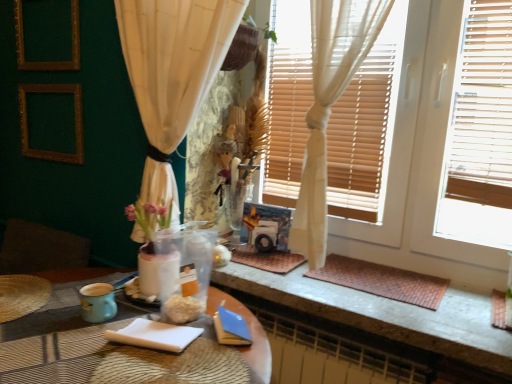
The height and width of the screenshot is (384, 512). Identify the location of vacant area located to the right-hand side of white paper notepad at lower center. (222, 345).